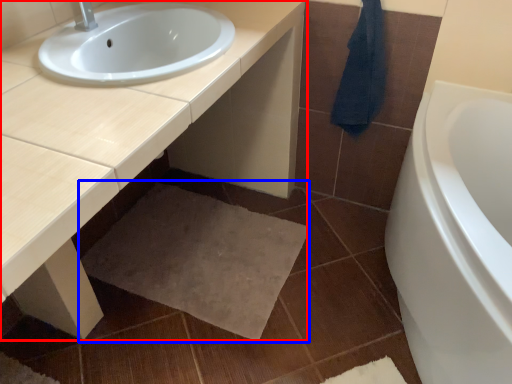
Question: Which of the following is the closest to the observer, countertop (highlighted by a red box) or bath mat (highlighted by a blue box)?

Choices:
 (A) countertop
 (B) bath mat

Answer: (A)